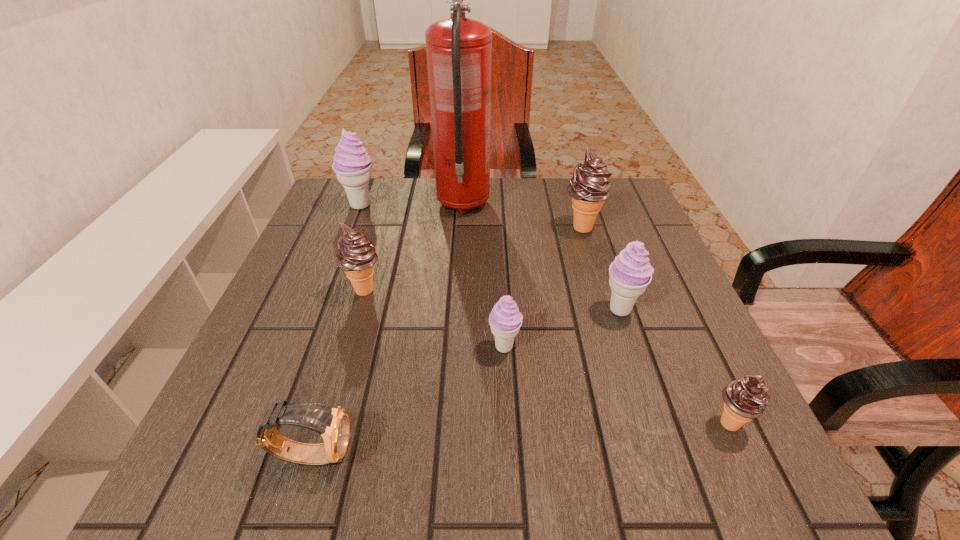
I want to click on vacant area situated on the left of the smallest chocolate icecream, so click(646, 423).

Identify the location of free space located 0.250m on the face of the gold watch. (518, 454).

This screenshot has width=960, height=540. Find the location of `fire extinguisher positioned at the far edge`. fire extinguisher positioned at the far edge is located at coordinates (459, 50).

Image resolution: width=960 pixels, height=540 pixels. Find the location of `object located at the near edge`. object located at the near edge is located at coordinates (333, 424).

At what (x,y) coordinates should I click in order to perform the action: click on watch that is at the left edge. Please return your answer as a coordinate pair (x, y). The width and height of the screenshot is (960, 540). Looking at the image, I should click on (333, 424).

The width and height of the screenshot is (960, 540). In order to click on object located in the far left corner section of the desktop in this screenshot , I will do `click(352, 165)`.

Find the location of a particular element. Image resolution: width=960 pixels, height=540 pixels. object that is at the near left corner is located at coordinates (333, 424).

The width and height of the screenshot is (960, 540). In order to click on object at the far right corner in this screenshot , I will do `click(589, 187)`.

At what (x,y) coordinates should I click in order to perform the action: click on vacant area at the far edge of the desktop. Please return your answer as a coordinate pair (x, y). This screenshot has height=540, width=960. Looking at the image, I should click on (498, 223).

In the image, there is a desktop. Where is `free space at the left edge`? free space at the left edge is located at coordinates (333, 316).